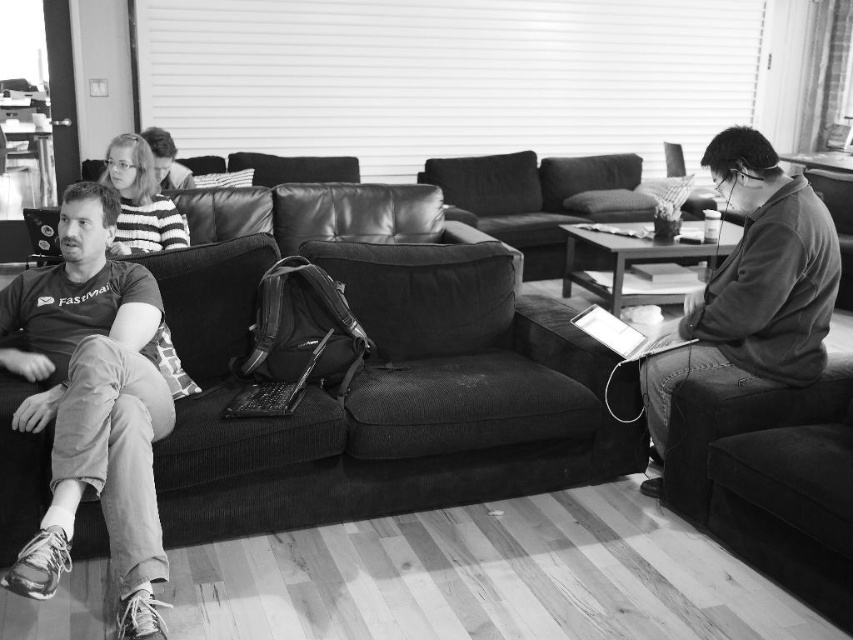
You are a photographer standing in the room and want to take a picture of both the soft fabric couch at center and the matte black laptop at left. Which object should you focus on first to ensure both are in sharp focus?

You should focus on the soft fabric couch at center first because it is closer to the viewer than the matte black laptop at left, so adjusting focus from near to far will help both objects be in focus.

You are standing in the living room and want to pick up an object. There are two points marked in the scene, point A at coordinates point(x=740, y=376) and point B at coordinates point(x=125, y=195). Which point is closer to you?

Point A at coordinates point(x=740, y=376) is closer to you than point B at coordinates point(x=125, y=195).